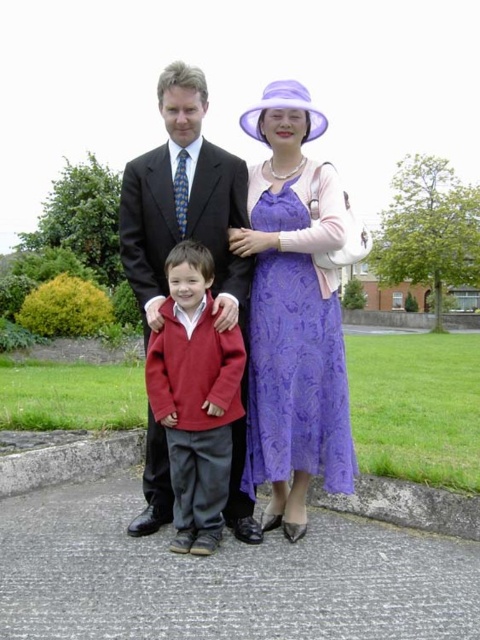
Measure the distance between point (286, 230) and camera.

The distance of point (286, 230) from camera is 5.78 meters.

Based on the photo, does purple lace dress at center appear on the left side of matte black suit at center?

No, purple lace dress at center is not to the left of matte black suit at center.

The width and height of the screenshot is (480, 640). What are the coordinates of `purple lace dress at center` in the screenshot? It's located at (297, 339).

Does purple lace dress at center have a lesser width compared to matte red sweater at center?

Incorrect, purple lace dress at center's width is not less than matte red sweater at center's.

Is purple lace dress at center shorter than matte red sweater at center?

In fact, purple lace dress at center may be taller than matte red sweater at center.

Does point (342, 481) come closer to viewer compared to point (199, 403)?

No.

Identify the location of purple lace dress at center. (297, 339).

Can you confirm if matte black suit at center is shorter than matte red sweater at center?

In fact, matte black suit at center may be taller than matte red sweater at center.

Does matte black suit at center appear over matte red sweater at center?

Yes.

You are a GUI agent. You are given a task and a screenshot of the screen. Output one action in this format:
    pyautogui.click(x=<x>, y=<y>)
    Task: Click on the matte black suit at center
    This screenshot has height=640, width=480.
    Given the screenshot: What is the action you would take?
    pyautogui.click(x=183, y=204)

Find the location of a particular element. matte black suit at center is located at coordinates (183, 204).